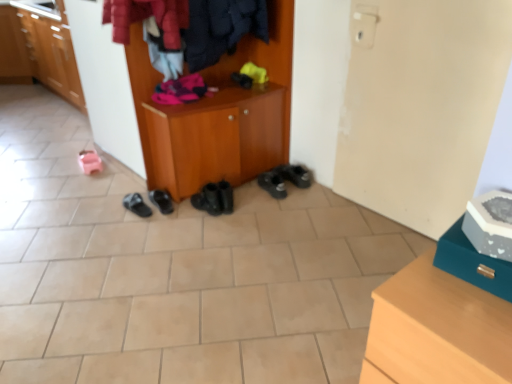
Where is `vacant space underneath black rubber sandals at center, placed as the 5th footwear when sorted from right to left (from a real-world perspective)`? This screenshot has width=512, height=384. vacant space underneath black rubber sandals at center, placed as the 5th footwear when sorted from right to left (from a real-world perspective) is located at coordinates (135, 207).